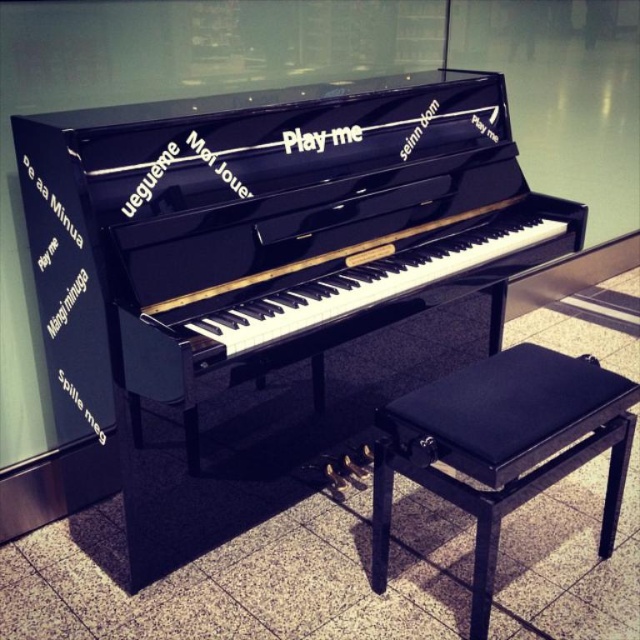
Is black polished piano at center to the left of black leather footrest at lower center from the viewer's perspective?

Yes, black polished piano at center is to the left of black leather footrest at lower center.

Does point (525, 188) come closer to viewer compared to point (522, 445)?

No, (525, 188) is behind (522, 445).

Describe the element at coordinates (260, 225) in the screenshot. I see `black polished piano at center` at that location.

At what (x,y) coordinates should I click in order to perform the action: click on black polished piano at center. Please return your answer as a coordinate pair (x, y). The height and width of the screenshot is (640, 640). Looking at the image, I should click on (260, 225).

Who is positioned more to the left, black leather music stool at center or black leather footrest at lower center?

From the viewer's perspective, black leather music stool at center appears more on the left side.

Does black leather music stool at center appear under black leather footrest at lower center?

Yes, black leather music stool at center is below black leather footrest at lower center.

Is point (477, 394) in front of point (483, 449)?

That is False.

Locate an element on the screen. black leather music stool at center is located at coordinates (500, 445).

Who is taller, black polished piano at center or black glossy text at left?

black polished piano at center

Between point (468, 84) and point (65, 364), which one is positioned in front?

Point (65, 364)

Find the location of a particular element. The width and height of the screenshot is (640, 640). black polished piano at center is located at coordinates (260, 225).